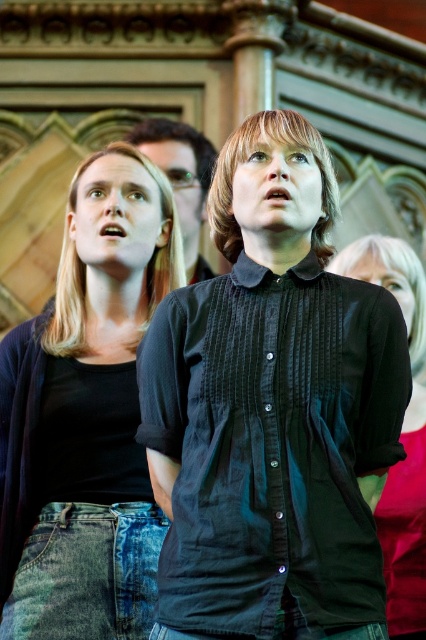
Question: Which of the following is the farthest from the observer?

Choices:
 (A) denim jeans at left
 (B) black button-up shirt at center
 (C) black cotton shirt at center

Answer: (A)

Question: Is denim jeans at left above black button-up shirt at center?

Choices:
 (A) no
 (B) yes

Answer: (A)

Question: Which of these objects is positioned closest to the denim jeans at left?

Choices:
 (A) black cotton shirt at center
 (B) black button-up shirt at center

Answer: (A)

Question: Does black cotton shirt at center appear on the left side of denim jeans at left?

Choices:
 (A) no
 (B) yes

Answer: (A)

Question: Which of these objects is positioned farthest from the denim jeans at left?

Choices:
 (A) black button-up shirt at center
 (B) black cotton shirt at center

Answer: (A)

Question: Does black cotton shirt at center appear on the left side of denim jeans at left?

Choices:
 (A) yes
 (B) no

Answer: (B)